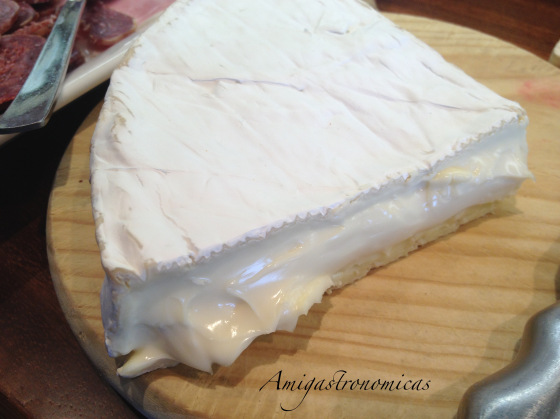
Find the location of `silverware`. silverware is located at coordinates (45, 73).